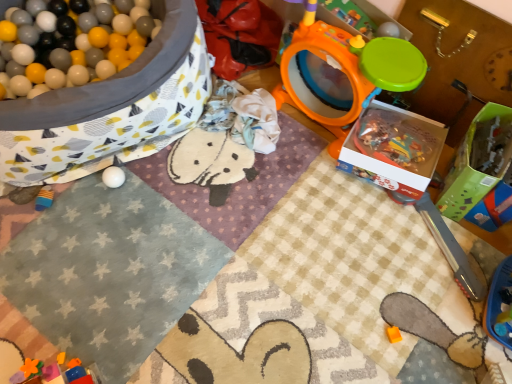
The image size is (512, 384). What do you see at coordinates (391, 142) in the screenshot?
I see `translucent plastic toy at center, arranged as the fifth toy when ordered from the bottom` at bounding box center [391, 142].

I want to click on orange matte toy at lower center, the second toy when ordered from bottom to top, so click(393, 334).

The width and height of the screenshot is (512, 384). What do you see at coordinates (113, 177) in the screenshot?
I see `white matte ball at lower left, which is the fourth toy in bottom-to-top order` at bounding box center [113, 177].

Identify the location of orange plastic drum at upper right, the third toy positioned from the right. (337, 74).

Is green cardboard box at right, which appears as the first box when viewed from the right, at the back of translucent plastic toy at center, acting as the 2th toy starting from the top?

translucent plastic toy at center, acting as the 2th toy starting from the top, does not have its back to green cardboard box at right, which appears as the first box when viewed from the right.

Starting from the green cardboard box at right, which appears as the first box when viewed from the right, which toy is the 1st one to the left? Please provide its 2D coordinates.

[(391, 142)]

From the image's perspective, is translucent plastic toy at center, the first toy from the right, located above or below green cardboard box at right, acting as the second box starting from the left?

From the image's perspective, translucent plastic toy at center, the first toy from the right, appears above green cardboard box at right, acting as the second box starting from the left.

From the image's perspective, starting from the white matte ball at lower left, the third toy viewed from the left, which toy is the 3rd one below? Please provide its 2D coordinates.

[(41, 369)]

Is rubberized plastic blocks at lower left, positioned as the first toy in bottom-to-top order, outside of white matte ball at lower left, which is the fourth toy in bottom-to-top order?

rubberized plastic blocks at lower left, positioned as the first toy in bottom-to-top order, is positioned outside white matte ball at lower left, which is the fourth toy in bottom-to-top order.

Is rubberized plastic blocks at lower left, which ranks as the fifth toy in right-to-left order, thinner than white matte ball at lower left, positioned as the third toy in top-to-bottom order?

No.

Considering the points (13, 361) and (121, 183), which point is in front, point (13, 361) or point (121, 183)?

The point (13, 361) is closer.

Is white cardboard box at center-right, the second box positioned from the right, bigger than rubberized plastic blocks at lower left, the 2th toy from the left?

Yes, white cardboard box at center-right, the second box positioned from the right, is bigger than rubberized plastic blocks at lower left, the 2th toy from the left.

From a real-world perspective, is white cardboard box at center-right, which ranks as the first box in left-to-right order, positioned over rubberized plastic blocks at lower left, which ranks as the fifth toy in right-to-left order, based on gravity?

No, from a real-world perspective, white cardboard box at center-right, which ranks as the first box in left-to-right order, is not above rubberized plastic blocks at lower left, which ranks as the fifth toy in right-to-left order.

Considering the sizes of objects white cardboard box at center-right, which ranks as the first box in left-to-right order, and rubberized plastic blocks at lower left, the 2th toy from the left, in the image provided, who is thinner, white cardboard box at center-right, which ranks as the first box in left-to-right order, or rubberized plastic blocks at lower left, the 2th toy from the left,?

rubberized plastic blocks at lower left, the 2th toy from the left.

Considering the points (411, 196) and (1, 347), which point is in front, point (411, 196) or point (1, 347)?

The point (1, 347) is closer.

Is green cardboard box at right, which appears as the first box when viewed from the right, positioned before white cardboard box at center-right, the second box positioned from the right?

That is True.

Image resolution: width=512 pixels, height=384 pixels. What are the coordinates of `box below the green cardboard box at right, acting as the second box starting from the left (from a real-world perspective)` in the screenshot? It's located at (394, 148).

From a real-world perspective, is green cardboard box at right, which appears as the first box when viewed from the right, physically above white cardboard box at center-right, the second box positioned from the right?

Yes, from a real-world perspective, green cardboard box at right, which appears as the first box when viewed from the right, is on top of white cardboard box at center-right, the second box positioned from the right.

Is white cardboard box at center-right, the second box positioned from the right, at the back of green cardboard box at right, acting as the second box starting from the left?

That's not correct — green cardboard box at right, acting as the second box starting from the left, is not looking away from white cardboard box at center-right, the second box positioned from the right.

Based on the photo, is the surface of white cardboard box at center-right, the second box positioned from the right, in direct contact with green cardboard box at right, acting as the second box starting from the left?

No.

Can you confirm if white cardboard box at center-right, which ranks as the first box in left-to-right order, is shorter than green cardboard box at right, which appears as the first box when viewed from the right?

Yes, white cardboard box at center-right, which ranks as the first box in left-to-right order, is shorter than green cardboard box at right, which appears as the first box when viewed from the right.

Is white cardboard box at center-right, which ranks as the first box in left-to-right order, oriented away from green cardboard box at right, which appears as the first box when viewed from the right?

No, white cardboard box at center-right, which ranks as the first box in left-to-right order, is not facing away from green cardboard box at right, which appears as the first box when viewed from the right.

Can you confirm if white cardboard box at center-right, which ranks as the first box in left-to-right order, is wider than green cardboard box at right, acting as the second box starting from the left?

Correct, the width of white cardboard box at center-right, which ranks as the first box in left-to-right order, exceeds that of green cardboard box at right, acting as the second box starting from the left.

Is white cardboard box at center-right, which ranks as the first box in left-to-right order, placed right next to blue rubber toy at lower left, placed as the 4th toy when sorted from top to bottom?

They are not placed beside each other.

At what (x,y) coordinates should I click in order to perform the action: click on the 5th toy to the left of the white cardboard box at center-right, the second box positioned from the right, starting your count from the anchor. Please return your answer as a coordinate pair (x, y). The height and width of the screenshot is (384, 512). Looking at the image, I should click on (44, 198).

Does point (403, 174) lie behind point (37, 206)?

No, it is in front of (37, 206).

Can we say white cardboard box at center-right, which ranks as the first box in left-to-right order, lies outside blue rubber toy at lower left, placed as the 4th toy when sorted from top to bottom?

Yes, white cardboard box at center-right, which ranks as the first box in left-to-right order, is outside of blue rubber toy at lower left, placed as the 4th toy when sorted from top to bottom.

Could white matte ball at lower left, the third toy viewed from the left, be considered to be inside orange matte toy at lower center, the second toy when ordered from bottom to top?

No, white matte ball at lower left, the third toy viewed from the left, is located outside of orange matte toy at lower center, the second toy when ordered from bottom to top.

Identify the location of the 1st toy directly beneath the white matte ball at lower left, which is the fourth toy in bottom-to-top order (from a real-world perspective). This screenshot has height=384, width=512. (393, 334).

Looking at their sizes, would you say orange matte toy at lower center, which ranks as the second toy in right-to-left order, is wider or thinner than white matte ball at lower left, which is counted as the fourth toy, starting from the right?

In the image, orange matte toy at lower center, which ranks as the second toy in right-to-left order, appears to be more narrow than white matte ball at lower left, which is counted as the fourth toy, starting from the right.

Is orange matte toy at lower center, the 5th toy when ordered from top to bottom, positioned far away from white matte ball at lower left, positioned as the third toy in top-to-bottom order?

No, there isn't a large distance between orange matte toy at lower center, the 5th toy when ordered from top to bottom, and white matte ball at lower left, positioned as the third toy in top-to-bottom order.

Where is `the 2nd box positioned below the translucent plastic toy at center, the 6th toy when ordered from left to right (from the image's perspective)`? the 2nd box positioned below the translucent plastic toy at center, the 6th toy when ordered from left to right (from the image's perspective) is located at coordinates (478, 161).

Image resolution: width=512 pixels, height=384 pixels. I want to click on the 1st toy to the right when counting from the rubberized plastic blocks at lower left, marked as the sixth toy in a top-to-bottom arrangement, so click(x=113, y=177).

In the scene shown: Considering their positions, is white cardboard box at center-right, which ranks as the first box in left-to-right order, positioned closer to orange plastic drum at upper right, arranged as the 4th toy when viewed from the left, than blue rubber toy at lower left, positioned as the 1th toy in left-to-right order?

The object closer to orange plastic drum at upper right, arranged as the 4th toy when viewed from the left, is white cardboard box at center-right, which ranks as the first box in left-to-right order.

Considering their positions, is blue rubber toy at lower left, which is the 6th toy from right to left, positioned closer to orange plastic drum at upper right, arranged as the 4th toy when viewed from the left, than green cardboard box at right, acting as the second box starting from the left?

green cardboard box at right, acting as the second box starting from the left.

Looking at the image, which one is located closer to blue rubber toy at lower left, placed as the 4th toy when sorted from top to bottom, white textured blanket at upper left or white cardboard box at center-right, the second box positioned from the right?

white textured blanket at upper left.

Considering their positions, is white cardboard box at center-right, the second box positioned from the right, positioned further to blue rubber toy at lower left, positioned as the 1th toy in left-to-right order, than white textured blanket at upper left?

white cardboard box at center-right, the second box positioned from the right, lies further to blue rubber toy at lower left, positioned as the 1th toy in left-to-right order, than the other object.

Based on their spatial positions, is orange plastic drum at upper right, acting as the 1th toy starting from the top, or white matte ball at lower left, the third toy viewed from the left, closer to green cardboard box at right, which appears as the first box when viewed from the right?

orange plastic drum at upper right, acting as the 1th toy starting from the top, is positioned closer to the anchor green cardboard box at right, which appears as the first box when viewed from the right.

Estimate the real-world distances between objects in this image. Which object is closer to blue rubber toy at lower left, positioned as the 1th toy in left-to-right order, green cardboard box at right, acting as the second box starting from the left, or white cardboard box at center-right, the second box positioned from the right?

Based on the image, white cardboard box at center-right, the second box positioned from the right, appears to be nearer to blue rubber toy at lower left, positioned as the 1th toy in left-to-right order.

Looking at the image, which one is located further to rubberized plastic blocks at lower left, the 2th toy from the left, white textured blanket at upper left or orange matte toy at lower center, which ranks as the second toy in right-to-left order?

orange matte toy at lower center, which ranks as the second toy in right-to-left order, lies further to rubberized plastic blocks at lower left, the 2th toy from the left, than the other object.

Looking at the image, which one is located further to rubberized plastic blocks at lower left, positioned as the first toy in bottom-to-top order, green cardboard box at right, which appears as the first box when viewed from the right, or orange plastic drum at upper right, acting as the 1th toy starting from the top?

The object further to rubberized plastic blocks at lower left, positioned as the first toy in bottom-to-top order, is green cardboard box at right, which appears as the first box when viewed from the right.

The height and width of the screenshot is (384, 512). I want to click on blanket situated between white matte ball at lower left, which is the fourth toy in bottom-to-top order, and orange matte toy at lower center, acting as the 5th toy starting from the left, from left to right, so [x=137, y=253].

The width and height of the screenshot is (512, 384). I want to click on box between white cardboard box at center-right, which ranks as the first box in left-to-right order, and orange matte toy at lower center, which ranks as the second toy in right-to-left order, in the vertical direction, so click(x=478, y=161).

At what (x,y) coordinates should I click in order to perform the action: click on blanket located between white matte ball at lower left, the third toy viewed from the left, and white cardboard box at center-right, which ranks as the first box in left-to-right order, in the left-right direction. Please return your answer as a coordinate pair (x, y). This screenshot has width=512, height=384. Looking at the image, I should click on (137, 253).

Find the location of a particular element. This screenshot has height=384, width=512. blanket positioned between rubberized plastic blocks at lower left, the 2th toy from the left, and white matte ball at lower left, the third toy viewed from the left, from near to far is located at coordinates 137,253.